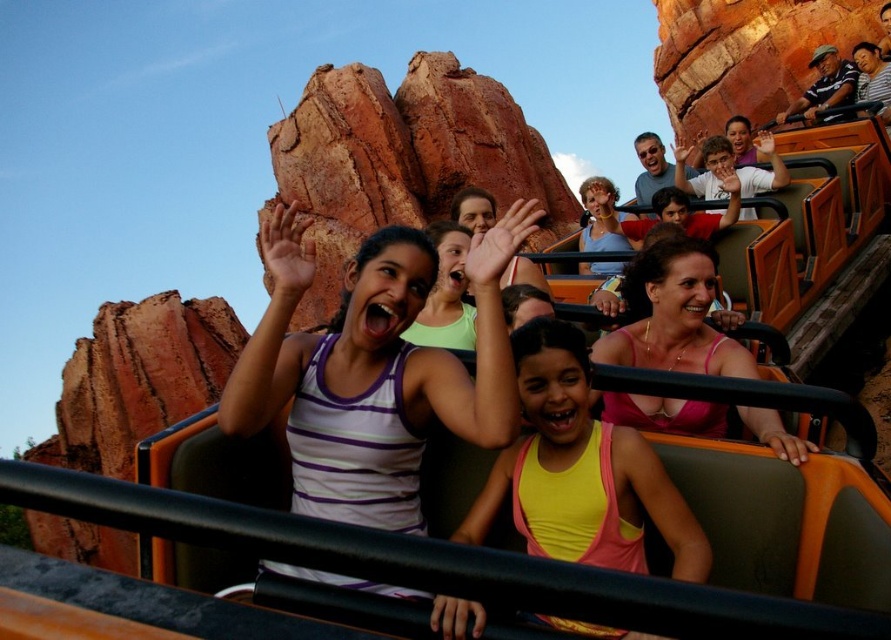
Question: Can you confirm if white striped tank top at center is positioned below yellow matte tank top at center?

Choices:
 (A) yes
 (B) no

Answer: (B)

Question: Is white striped tank top at center wider than yellow matte tank top at center?

Choices:
 (A) no
 (B) yes

Answer: (B)

Question: Can you confirm if white striped tank top at center is positioned above yellow matte tank top at center?

Choices:
 (A) no
 (B) yes

Answer: (B)